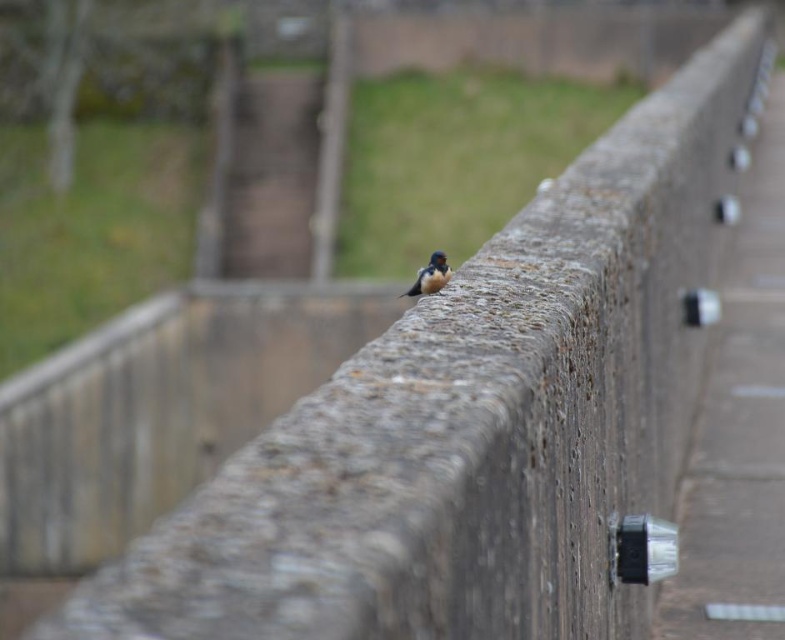
Is concrete at right shorter than satin plumage bird at center?

Incorrect, concrete at right's height does not fall short of satin plumage bird at center's.

Who is more forward, [780,518] or [426,266]?

Point [426,266] is in front.

Where is `concrete at right`? concrete at right is located at coordinates (739, 429).